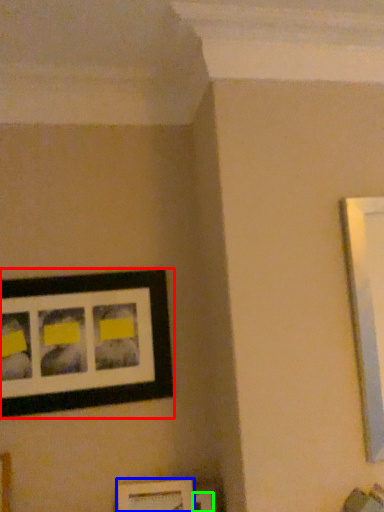
Question: Considering the real-world distances, which object is closest to picture frame (highlighted by a red box)? picture frame (highlighted by a blue box) or picture frame (highlighted by a green box).

Choices:
 (A) picture frame
 (B) picture frame

Answer: (A)